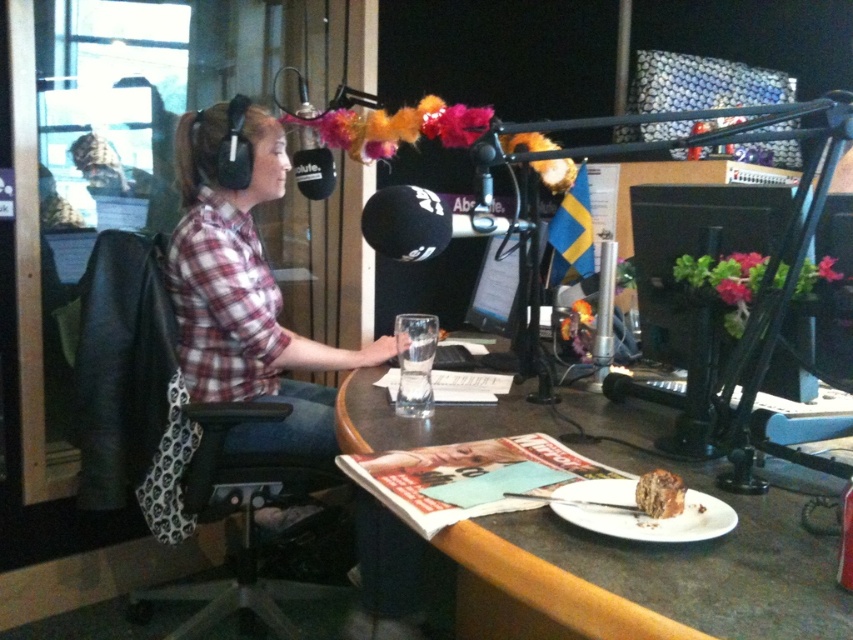
You are a technician in the studio and need to adjust the lighting so that it shines directly on the point at coordinates point (822, 577). The camera is positioned at a certain distance. Can you estimate if the light will reach the point from the camera position if the light source is placed 30 inches away from the camera?

The distance of point (822, 577) from camera is 33.13 inches. Since the light source is placed 30 inches away from the camera, it is closer than the point, so the light may not reach the point unless adjusted further away.

What is located at the coordinates point (637, 573) in the radio studio scene?

At point (637, 573) lies smooth brown table at center.

You are a technician in the radio studio and need to place a new microphone stand at the exact center of the studio. The smooth brown table at center is located at coordinates point 0.897, 0.749. Can you determine if the table is positioned at the exact center of the studio?

The smooth brown table at center is located at point (637, 573), which does not correspond to the exact center coordinates of the studio. Therefore, the table is not positioned at the exact center of the studio.